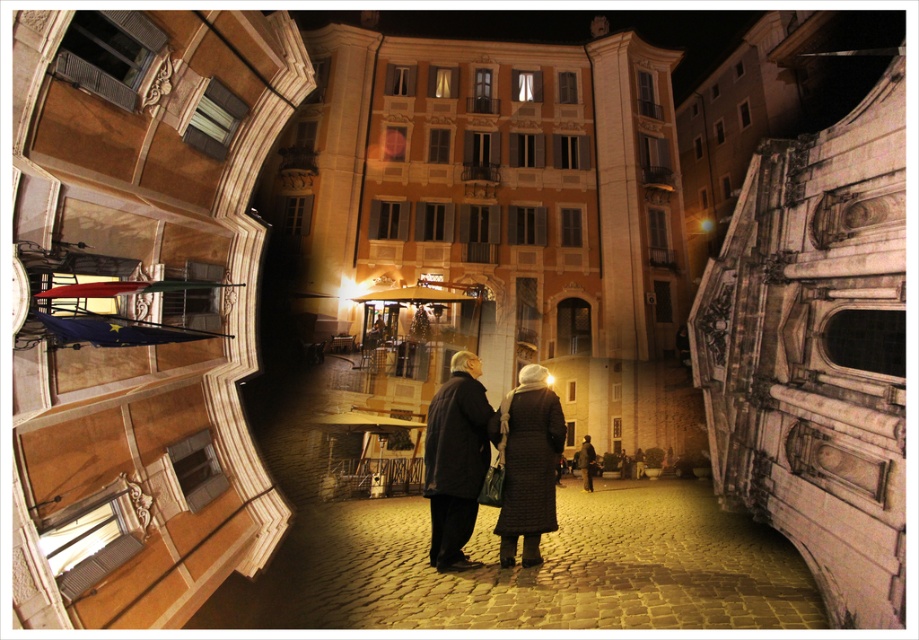
Measure the distance between dark wool coat at center and dark gray coat at center.

They are 79.23 feet apart.

Is dark wool coat at center to the left of dark gray coat at center from the viewer's perspective?

Indeed, dark wool coat at center is positioned on the left side of dark gray coat at center.

You are a GUI agent. You are given a task and a screenshot of the screen. Output one action in this format:
    pyautogui.click(x=<x>, y=<y>)
    Task: Click on the dark wool coat at center
    Image resolution: width=919 pixels, height=640 pixels.
    Given the screenshot: What is the action you would take?
    pyautogui.click(x=456, y=458)

Identify the location of dark wool coat at center. This screenshot has height=640, width=919. (456, 458).

Does dark wool coat at center lie behind quilted black coat at center?

No, it is not.

Who is taller, dark wool coat at center or quilted black coat at center?

dark wool coat at center

Is point (471, 456) closer to viewer compared to point (518, 413)?

Yes, it is.

The height and width of the screenshot is (640, 919). Identify the location of dark wool coat at center. (456, 458).

Who is lower down, quilted black coat at center or dark gray coat at center?

dark gray coat at center is below.

Which is above, quilted black coat at center or dark gray coat at center?

quilted black coat at center is above.

Identify the location of quilted black coat at center. The width and height of the screenshot is (919, 640). (528, 464).

In order to click on quilted black coat at center in this screenshot , I will do `click(528, 464)`.